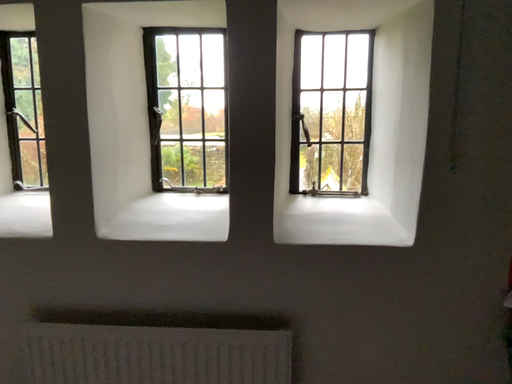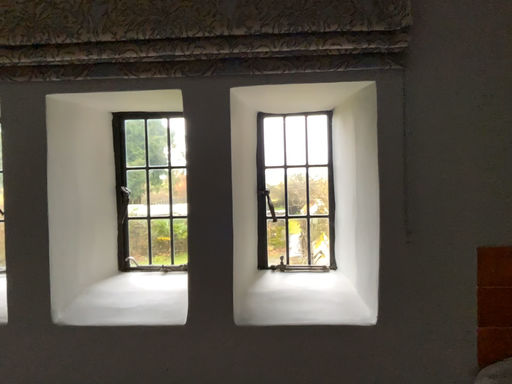
Question: How did the camera likely rotate when shooting the video?

Choices:
 (A) rotated upward
 (B) rotated downward

Answer: (A)